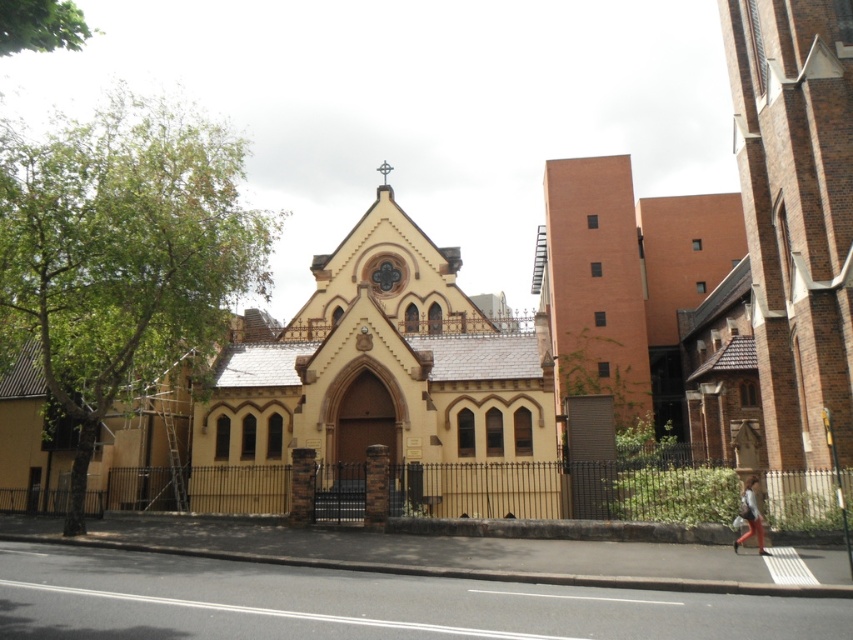
Question: Which of the following is the farthest from the observer?

Choices:
 (A) (270, 394)
 (B) (579, 252)
 (C) (750, 529)

Answer: (B)

Question: Does matte yellow chapel at center lie in front of denim pants at lower right?

Choices:
 (A) yes
 (B) no

Answer: (B)

Question: Is brick wall building at center above denim pants at lower right?

Choices:
 (A) no
 (B) yes

Answer: (B)

Question: Which point is farther to the camera?

Choices:
 (A) (639, 394)
 (B) (757, 506)

Answer: (A)

Question: Which is nearer to the matte yellow chapel at center?

Choices:
 (A) denim pants at lower right
 (B) brick wall building at center

Answer: (B)

Question: Is brick wall building at center smaller than denim pants at lower right?

Choices:
 (A) no
 (B) yes

Answer: (A)